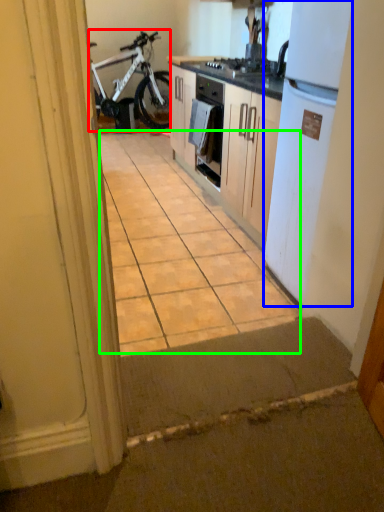
Question: Which object is the closest to the bicycle (highlighted by a red box)? Choose among these: refrigerator (highlighted by a blue box) or ceramic tile (highlighted by a green box).

Choices:
 (A) refrigerator
 (B) ceramic tile

Answer: (B)